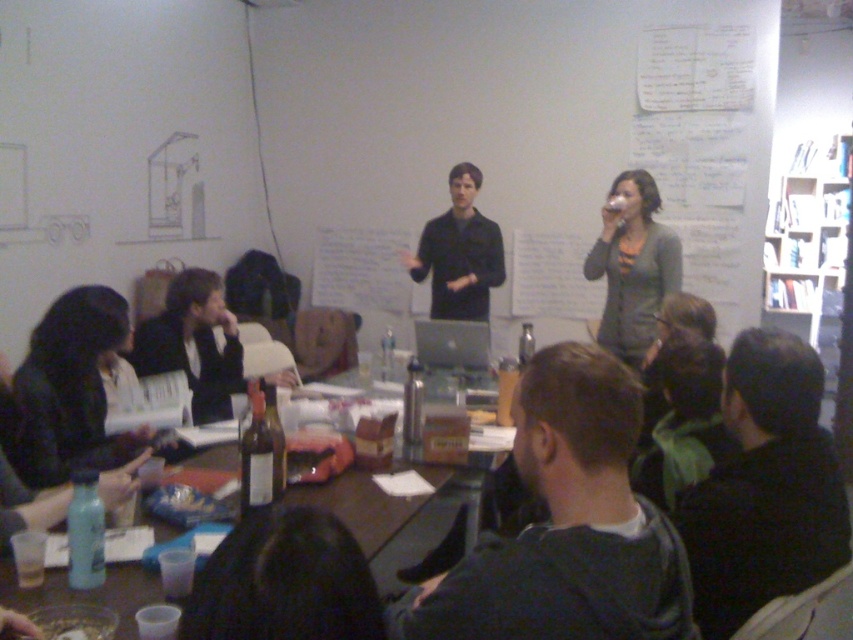
You are a photographer trying to capture a candid shot of the two people at the lower left of the scene. Since you want to ensure both are in focus, you need to know which one is closer to the camera. Can you determine which of the dark brown hair at lower left or the matte black jacket at lower left is closer to you?

The dark brown hair at lower left is smaller than the matte black jacket at lower left, so the matte black jacket at lower left is closer to you.

You are a participant in the meeting and need to place a small notebook on the brown wooden table at lower center. However, there is a dark gray sweater at center on the table. Can you place the notebook there without moving the sweater?

The dark gray sweater at center has a greater height compared to brown wooden table at lower center, so placing the notebook on the table might be possible, but the sweater is on the table and occupies space. You may need to adjust the sweater or place the notebook next to it.

You are a participant in the meeting and need to hand a document to the person wearing the dark gray sweater at center. You are currently standing near the brown wooden table at lower center. Can you directly hand them the document without moving around the table?

The dark gray sweater at center is closer to the viewer than the brown wooden table at lower center, so yes, you can directly hand them the document without needing to move around the table since they are closer to you.